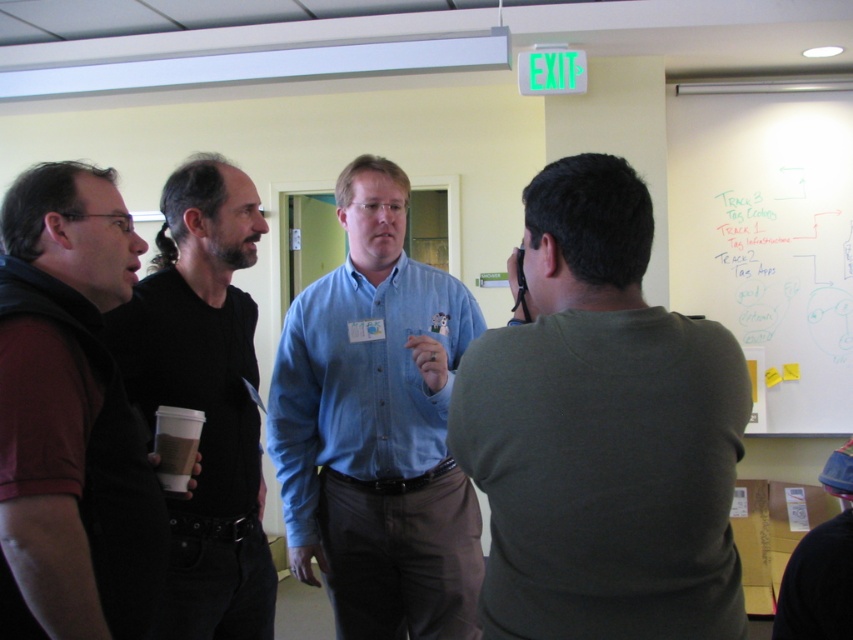
Question: Estimate the real-world distances between objects in this image. Which object is closer to the denim shirt at center?

Choices:
 (A) maroon fabric shirt at left
 (B) whiteboard at upper right

Answer: (A)

Question: Which object appears farthest from the camera in this image?

Choices:
 (A) blue fabric cap at lower right
 (B) whiteboard at upper right

Answer: (B)

Question: Among these points, which one is nearest to the camera?

Choices:
 (A) click(x=222, y=364)
 (B) click(x=814, y=534)
 (C) click(x=26, y=582)
 (D) click(x=421, y=264)

Answer: (C)

Question: Does whiteboard at upper right have a larger size compared to blue fabric cap at lower right?

Choices:
 (A) yes
 (B) no

Answer: (A)

Question: Can you confirm if dark green t-shirt at center is positioned above black matte shirt at left?

Choices:
 (A) yes
 (B) no

Answer: (A)

Question: Is black matte shirt at left wider than blue fabric cap at lower right?

Choices:
 (A) no
 (B) yes

Answer: (B)